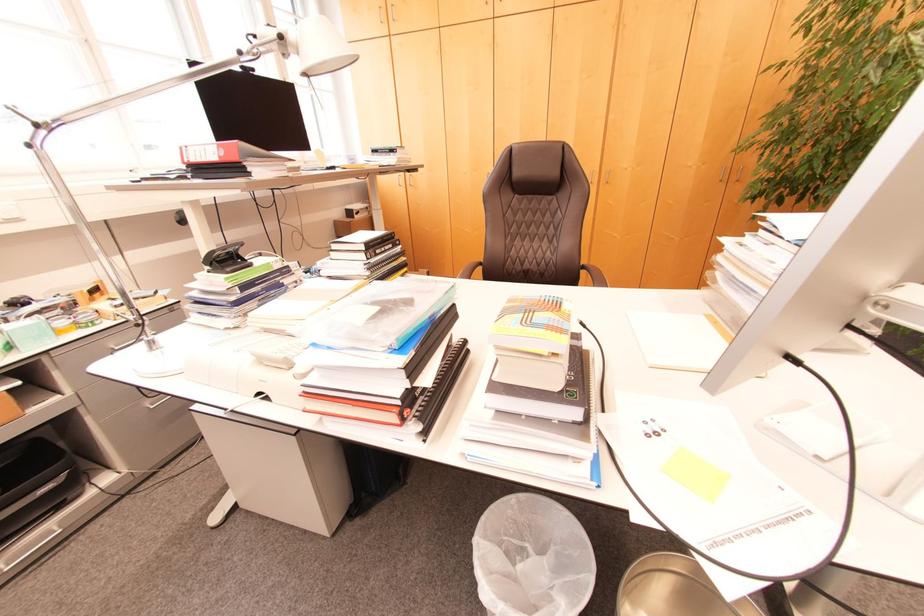
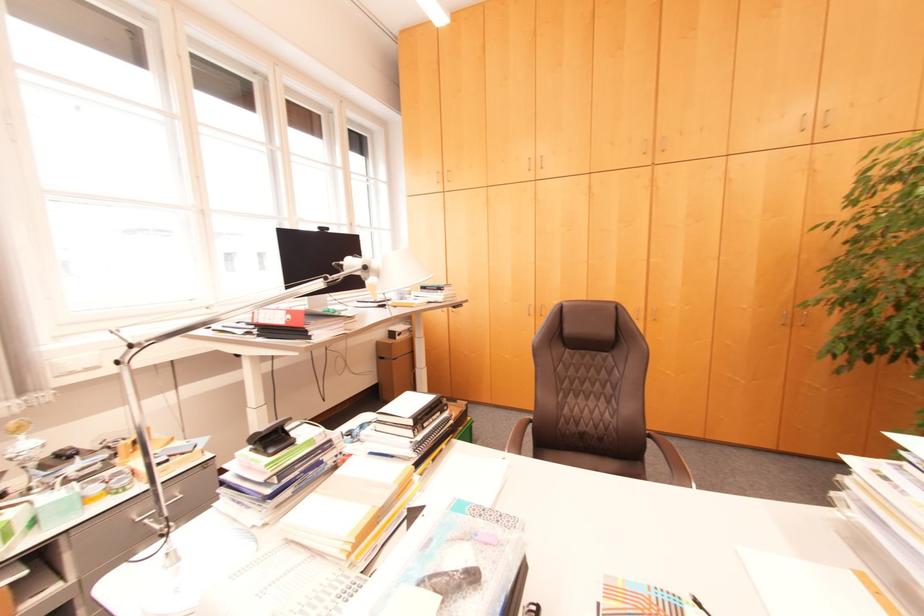
Question: Based on the continuous images, in which direction is the camera rotating? Reply with the corresponding letter.

Choices:
 (A) Left
 (B) Right
 (C) Up
 (D) Down

Answer: (C)